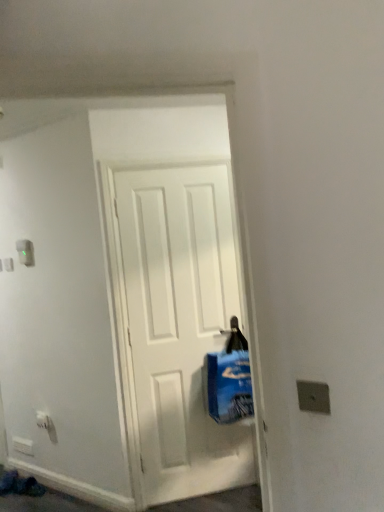
The image size is (384, 512). What do you see at coordinates (42, 420) in the screenshot?
I see `white plastic electric outlet at lower left` at bounding box center [42, 420].

The width and height of the screenshot is (384, 512). Find the location of `blue plastic bag at center`. blue plastic bag at center is located at coordinates (230, 379).

From the picture: What's the angular difference between white plastic light switch at upper left and white plastic electric outlet at lower left's facing directions?

The angle between the facing direction of white plastic light switch at upper left and the facing direction of white plastic electric outlet at lower left is 0.00418 degrees.

Can you confirm if white plastic light switch at upper left is shorter than white plastic electric outlet at lower left?

In fact, white plastic light switch at upper left may be taller than white plastic electric outlet at lower left.

Where is `light switch located in front of the white plastic electric outlet at lower left`? The height and width of the screenshot is (512, 384). light switch located in front of the white plastic electric outlet at lower left is located at coordinates (25, 252).

Looking at this image, which object is more forward, white plastic light switch at upper left or white plastic electric outlet at lower left?

white plastic light switch at upper left.

Does point (231, 377) come in front of point (39, 418)?

Yes.

Which object is wider, blue plastic bag at center or white plastic electric outlet at lower left?

blue plastic bag at center is wider.

Is blue plastic bag at center positioned beyond the bounds of white plastic electric outlet at lower left?

Absolutely, blue plastic bag at center is external to white plastic electric outlet at lower left.

Could you tell me if blue plastic bag at center is turned towards white plastic electric outlet at lower left?

No, blue plastic bag at center does not turn towards white plastic electric outlet at lower left.

Consider the image. Considering the positions of objects blue plastic bag at center and white plastic light switch at upper left in the image provided, who is in front, blue plastic bag at center or white plastic light switch at upper left?

blue plastic bag at center.

How different are the orientations of blue plastic bag at center and white plastic light switch at upper left in degrees?

44.6 degrees separate the facing orientations of blue plastic bag at center and white plastic light switch at upper left.

Is blue plastic bag at center oriented towards white plastic light switch at upper left?

No, blue plastic bag at center is not aimed at white plastic light switch at upper left.

From the image's perspective, is white plastic electric outlet at lower left located above or below white plastic light switch at upper left?

Based on their image positions, white plastic electric outlet at lower left is located beneath white plastic light switch at upper left.

Considering the sizes of objects white plastic electric outlet at lower left and white plastic light switch at upper left in the image provided, who is wider, white plastic electric outlet at lower left or white plastic light switch at upper left?

Wider between the two is white plastic electric outlet at lower left.

The height and width of the screenshot is (512, 384). Identify the location of light switch that is on the left side of white plastic electric outlet at lower left. (25, 252).

From a real-world perspective, is white plastic electric outlet at lower left located beneath white plastic light switch at upper left?

Correct, in the physical world, white plastic electric outlet at lower left is lower than white plastic light switch at upper left.

Which is behind, point (26, 259) or point (210, 403)?

The point (26, 259) is behind.

Consider the image. In the image, is white plastic light switch at upper left positioned in front of or behind blue plastic bag at center?

white plastic light switch at upper left is behind blue plastic bag at center.

Can you confirm if white plastic light switch at upper left is smaller than blue plastic bag at center?

Indeed, white plastic light switch at upper left has a smaller size compared to blue plastic bag at center.

Does white plastic electric outlet at lower left appear on the left side of blue plastic bag at center?

Yes.

In terms of width, does white plastic electric outlet at lower left look wider or thinner when compared to blue plastic bag at center?

Considering their sizes, white plastic electric outlet at lower left looks slimmer than blue plastic bag at center.

Which is in front, point (47, 418) or point (235, 407)?

Positioned in front is point (235, 407).

From the image's perspective, is white plastic electric outlet at lower left under blue plastic bag at center?

Yes.

Where is `electric outlet on the right of white plastic light switch at upper left`? electric outlet on the right of white plastic light switch at upper left is located at coordinates (42, 420).

Locate an element on the screen. electric outlet below the blue plastic bag at center (from a real-world perspective) is located at coordinates [x=42, y=420].

Estimate the real-world distances between objects in this image. Which object is further from blue plastic bag at center, white plastic electric outlet at lower left or white plastic light switch at upper left?

The object further to blue plastic bag at center is white plastic light switch at upper left.

From the image, which object appears to be farther from blue plastic bag at center, white plastic light switch at upper left or white plastic electric outlet at lower left?

The object further to blue plastic bag at center is white plastic light switch at upper left.

Which object lies nearer to the anchor point white plastic light switch at upper left, white plastic electric outlet at lower left or blue plastic bag at center?

white plastic electric outlet at lower left.

Which object lies nearer to the anchor point white plastic electric outlet at lower left, white plastic light switch at upper left or blue plastic bag at center?

The object closer to white plastic electric outlet at lower left is white plastic light switch at upper left.

When comparing their distances from white plastic light switch at upper left, does blue plastic bag at center or white plastic electric outlet at lower left seem closer?

white plastic electric outlet at lower left is positioned closer to the anchor white plastic light switch at upper left.

Considering their positions, is blue plastic bag at center positioned closer to white plastic electric outlet at lower left than white plastic light switch at upper left?

white plastic light switch at upper left is closer to white plastic electric outlet at lower left.

Locate an element on the screen. Image resolution: width=384 pixels, height=512 pixels. electric outlet between white plastic light switch at upper left and blue plastic bag at center in the horizontal direction is located at coordinates (42, 420).